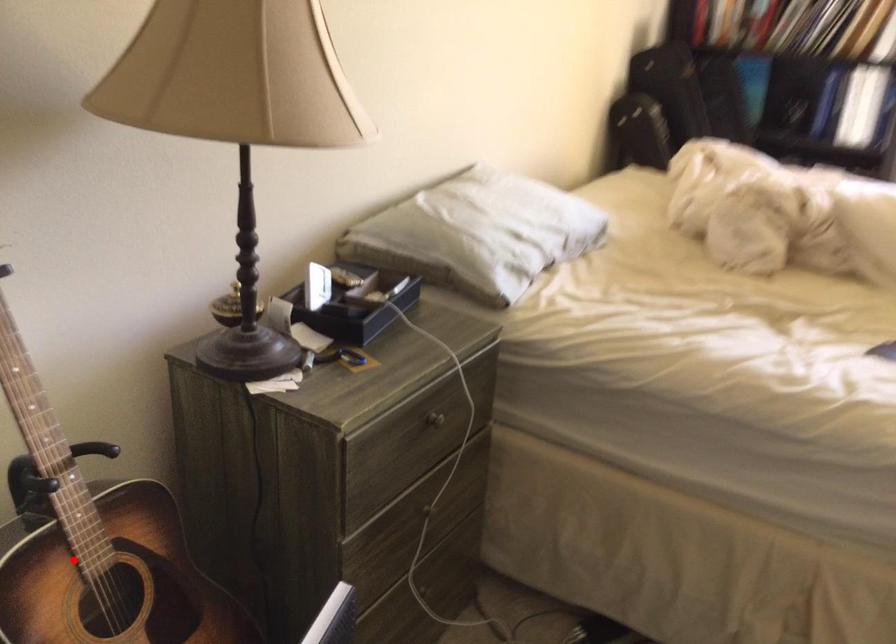
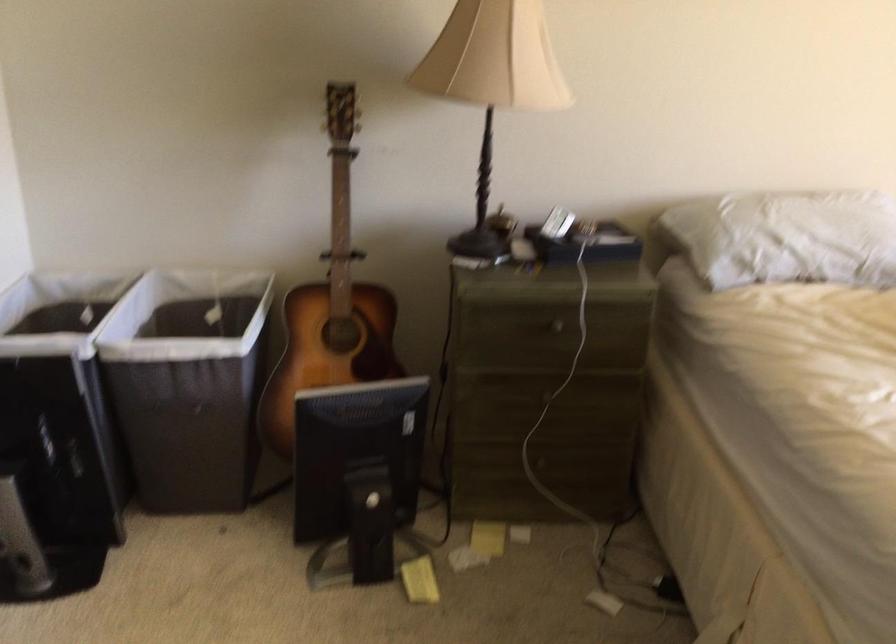
Question: I am providing you with two images of the same scene from different viewpoints. Given a red point in image1, look at the same physical point in image2. Is it:

Choices:
 (A) Closer to the viewpoint
 (B) Farther from the viewpoint

Answer: (B)